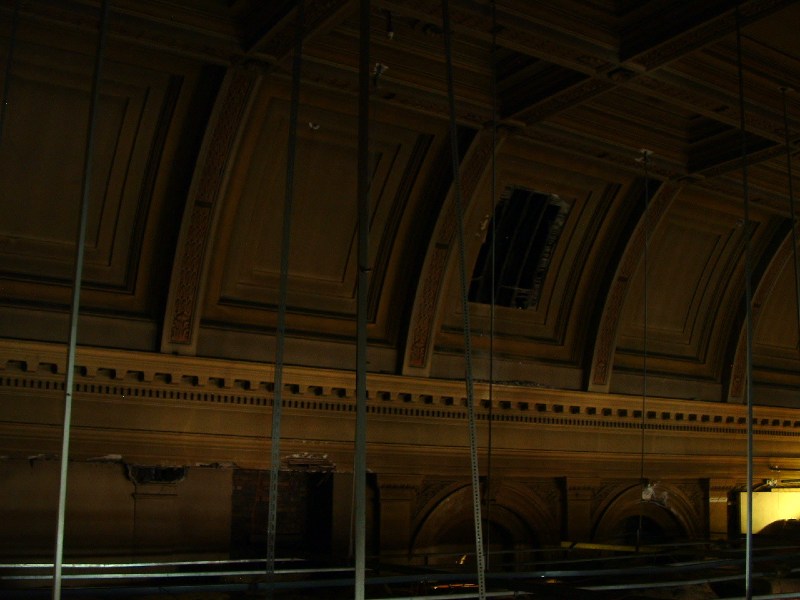
I want to click on pillars on the wall, so click(206, 236), click(428, 280), click(613, 300), click(738, 369).